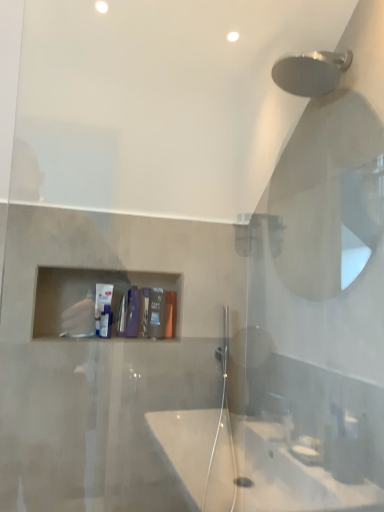
Question: Is matte black soap at center, which is the 2th toiletry from left to right, wider or thinner than white matte tube at center, positioned as the 3th toiletry in right-to-left order?

Choices:
 (A) wide
 (B) thin

Answer: (A)

Question: Based on their positions, is matte black soap at center, which is the 2th toiletry from left to right, located to the left or right of white matte tube at center, positioned as the 3th toiletry in right-to-left order?

Choices:
 (A) left
 (B) right

Answer: (B)

Question: Estimate the real-world distances between objects in this image. Which object is farther from the matte plastic container at center, the first toiletry from the right?

Choices:
 (A) matte black soap at center, which is the 2th toiletry from left to right
 (B) white matte tube at center, which is the 1th toiletry from left to right

Answer: (B)

Question: Which object is positioned farthest from the matte plastic container at center, marked as the 3th toiletry in a left-to-right arrangement?

Choices:
 (A) matte black soap at center, which is the 2th toiletry from left to right
 (B) white matte tube at center, positioned as the 3th toiletry in right-to-left order

Answer: (B)